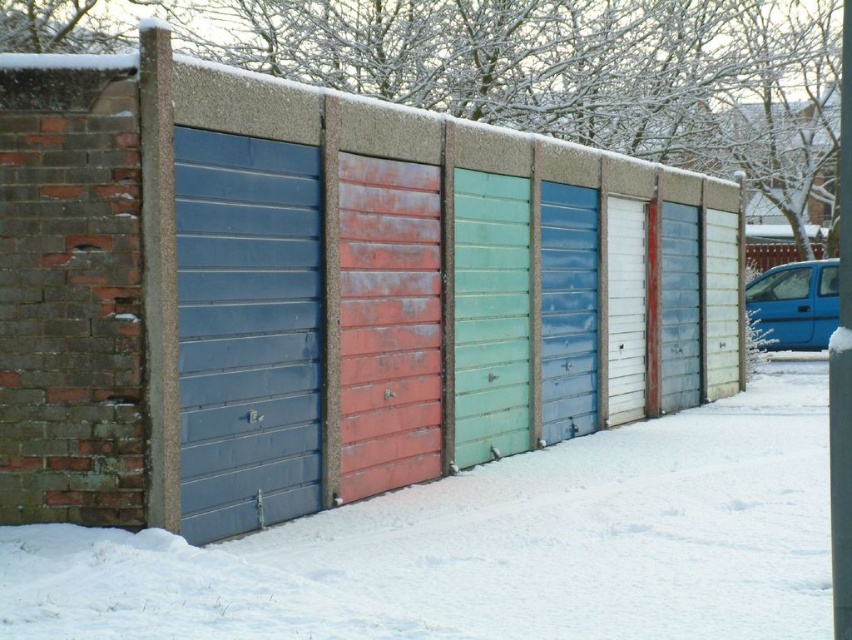
Question: Is white powdery snow at lower center smaller than metallic red fence at right?

Choices:
 (A) no
 (B) yes

Answer: (A)

Question: Which of these objects is positioned farthest from the matte blue metal door at left?

Choices:
 (A) metallic red fence at right
 (B) white powdery snow at lower center

Answer: (A)

Question: Which object appears farthest from the camera in this image?

Choices:
 (A) metallic red fence at right
 (B) matte blue metal door at left
 (C) white powdery snow at lower center

Answer: (A)

Question: Can you confirm if matte blue metal door at left is positioned to the left of metallic red fence at right?

Choices:
 (A) no
 (B) yes

Answer: (B)

Question: Does white powdery snow at lower center have a lesser width compared to metallic red fence at right?

Choices:
 (A) yes
 (B) no

Answer: (B)

Question: Which point is closer to the camera?

Choices:
 (A) metallic red fence at right
 (B) matte blue metal door at left

Answer: (B)